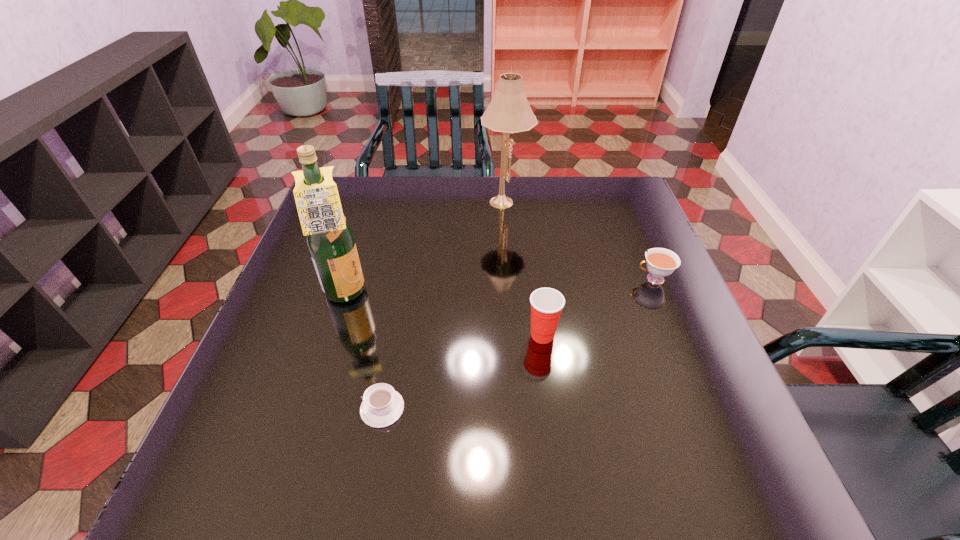
The width and height of the screenshot is (960, 540). I want to click on vacant area that lies between the shortest object and the liquor, so click(364, 352).

The height and width of the screenshot is (540, 960). Identify the location of empty space that is in between the left teacup and the taller teacup. (517, 343).

Where is `unoccupied position between the fourth farthest object and the leftmost object`? The image size is (960, 540). unoccupied position between the fourth farthest object and the leftmost object is located at coordinates (444, 315).

Identify the location of vacant area that lies between the rightmost object and the third shortest object. (598, 307).

The width and height of the screenshot is (960, 540). In order to click on the closest object to the liquor in this screenshot , I will do [382, 406].

Locate an element on the screen. The width and height of the screenshot is (960, 540). the fourth closest object to the second nearest object is located at coordinates (509, 112).

You are a GUI agent. You are given a task and a screenshot of the screen. Output one action in this format:
    pyautogui.click(x=<x>, y=<y>)
    Task: Click on the free point that satisfies the following two spatial constraints: 1. on the front side of the lampshade; 2. on the handle side of the shorter teacup
    
    Given the screenshot: What is the action you would take?
    pyautogui.click(x=521, y=408)

Where is `free location that satisfies the following two spatial constraints: 1. on the front side of the Dixie cup; 2. on the left side of the lampshade`? free location that satisfies the following two spatial constraints: 1. on the front side of the Dixie cup; 2. on the left side of the lampshade is located at coordinates (516, 335).

Image resolution: width=960 pixels, height=540 pixels. What are the coordinates of `free spot that satisfies the following two spatial constraints: 1. on the front side of the farthest object; 2. on the front-facing side of the liquor` in the screenshot? It's located at click(513, 294).